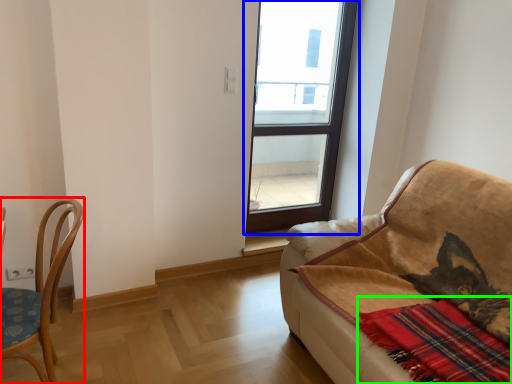
Question: Estimate the real-world distances between objects in this image. Which object is closer to chair (highlighted by a red box), window (highlighted by a blue box) or plaid (highlighted by a green box)?

Choices:
 (A) window
 (B) plaid

Answer: (B)